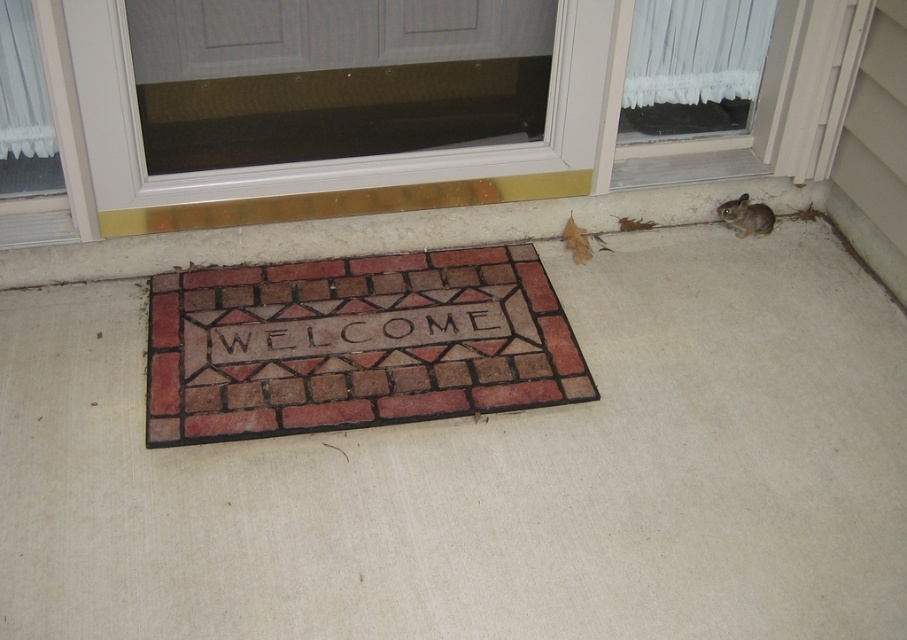
Is white brick-like at center to the left of brown furry squirrel at lower right from the viewer's perspective?

Indeed, white brick-like at center is positioned on the left side of brown furry squirrel at lower right.

Does point (299, 355) come closer to viewer compared to point (759, 236)?

Yes.

In order to click on white brick-like at center in this screenshot , I will do `click(356, 332)`.

Is brick-patterned welcome mat at center closer to the viewer compared to brown furry squirrel at lower right?

Yes, brick-patterned welcome mat at center is in front of brown furry squirrel at lower right.

Which is behind, point (237, 342) or point (743, 234)?

The point (743, 234) is more distant.

The image size is (907, 640). What are the coordinates of `brick-patterned welcome mat at center` in the screenshot? It's located at (356, 342).

The height and width of the screenshot is (640, 907). What are the coordinates of `brick-patterned welcome mat at center` in the screenshot? It's located at (356, 342).

What do you see at coordinates (356, 342) in the screenshot? The image size is (907, 640). I see `brick-patterned welcome mat at center` at bounding box center [356, 342].

Can you confirm if brick-patterned welcome mat at center is positioned to the left of transparent glass door at upper center?

No, brick-patterned welcome mat at center is not to the left of transparent glass door at upper center.

Describe the element at coordinates (356, 342) in the screenshot. I see `brick-patterned welcome mat at center` at that location.

The height and width of the screenshot is (640, 907). In order to click on brick-patterned welcome mat at center in this screenshot , I will do `click(356, 342)`.